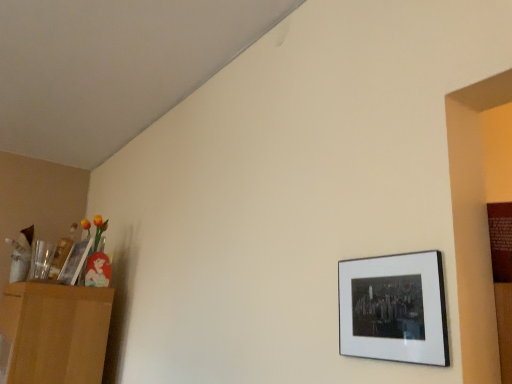
Question: Considering the positions of light brown wooden dresser at left and matte black picture frame at lower right, marked as the 1th picture frame in a front-to-back arrangement, in the image, is light brown wooden dresser at left taller or shorter than matte black picture frame at lower right, marked as the 1th picture frame in a front-to-back arrangement,?

Choices:
 (A) tall
 (B) short

Answer: (A)

Question: Is light brown wooden dresser at left in front of or behind matte black picture frame at lower right, positioned as the 1th picture frame in right-to-left order, in the image?

Choices:
 (A) behind
 (B) front

Answer: (A)

Question: Which of these objects is positioned closest to the matte black picture frame at lower right, marked as the 1th picture frame in a front-to-back arrangement?

Choices:
 (A) light brown wooden dresser at left
 (B) wooden picture frame at left, which ranks as the 1th picture frame in left-to-right order

Answer: (A)

Question: Which of these objects is positioned closest to the matte black picture frame at lower right, positioned as the 1th picture frame in right-to-left order?

Choices:
 (A) light brown wooden dresser at left
 (B) wooden picture frame at left, arranged as the 2th picture frame when viewed from the front

Answer: (A)